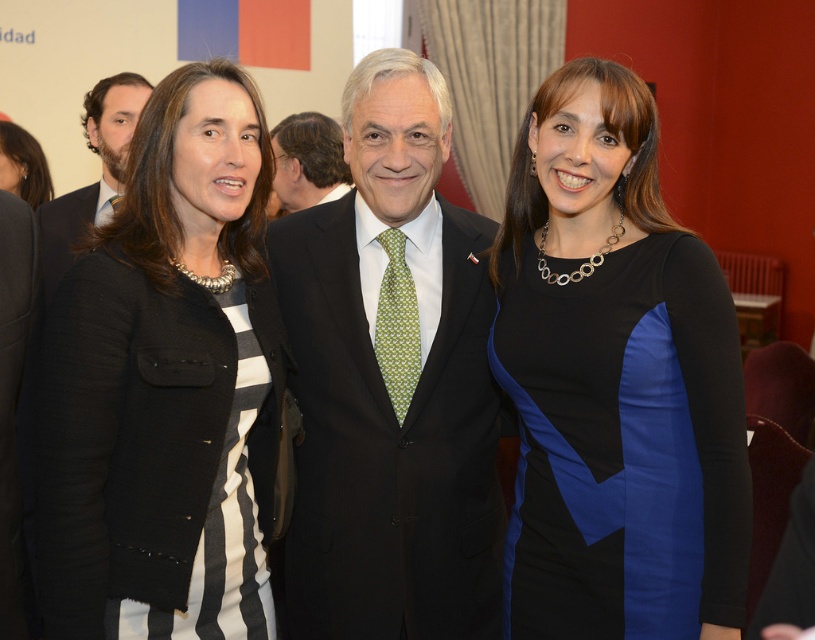
Is matte black suit at left shorter than matte black jacket at upper left?

No.

What do you see at coordinates (93, 182) in the screenshot?
I see `matte black suit at left` at bounding box center [93, 182].

Where is `matte black suit at left`? The image size is (815, 640). matte black suit at left is located at coordinates (93, 182).

Between point (122, 292) and point (34, 180), which one is positioned in front?

Positioned in front is point (122, 292).

The width and height of the screenshot is (815, 640). Describe the element at coordinates (163, 387) in the screenshot. I see `black textured blazer at left` at that location.

The image size is (815, 640). What do you see at coordinates (163, 387) in the screenshot? I see `black textured blazer at left` at bounding box center [163, 387].

Where is `black textured blazer at left`? Image resolution: width=815 pixels, height=640 pixels. black textured blazer at left is located at coordinates (163, 387).

Does black textured blazer at left lie in front of matte black suit at center?

Yes, black textured blazer at left is closer to the viewer.

Is point (93, 625) positioned in front of point (413, 474)?

Yes, point (93, 625) is closer to viewer.

Which is in front, point (206, 532) or point (355, 589)?

Positioned in front is point (206, 532).

This screenshot has width=815, height=640. In order to click on black textured blazer at left in this screenshot , I will do pyautogui.click(x=163, y=387).